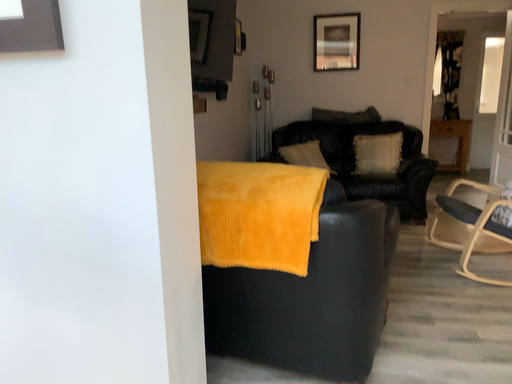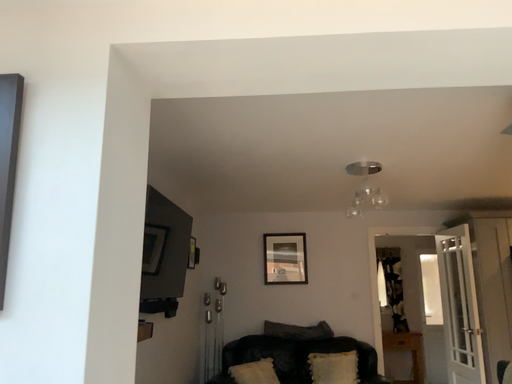
Question: Which way did the camera rotate in the video?

Choices:
 (A) rotated downward
 (B) rotated upward

Answer: (B)